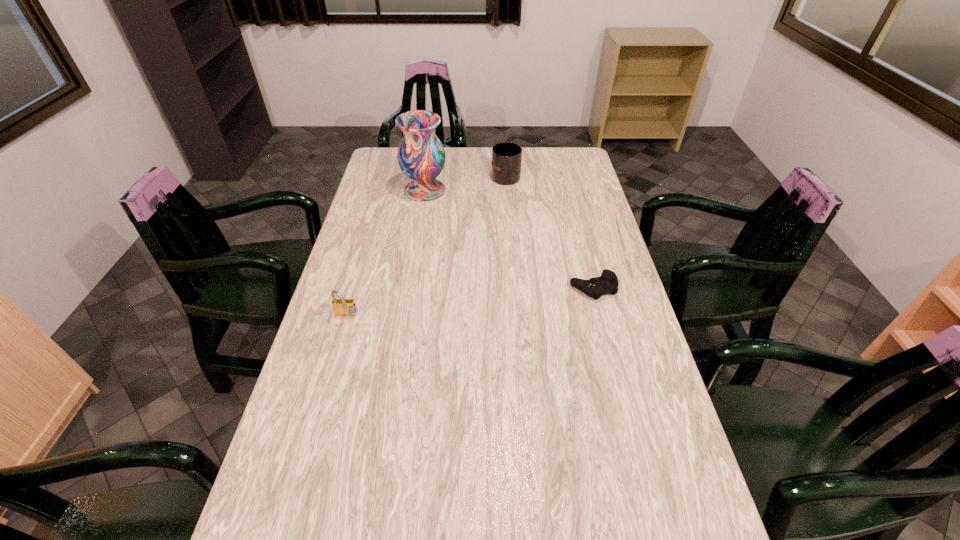
The width and height of the screenshot is (960, 540). What are the coordinates of `free location located with the handle on the side of the second object from right to left` in the screenshot? It's located at (504, 154).

What are the coordinates of `free spot located on the side with the combination dials of the nearest object` in the screenshot? It's located at (311, 438).

Where is `vacant space situated 0.270m on the back of the control`? The width and height of the screenshot is (960, 540). vacant space situated 0.270m on the back of the control is located at coordinates (x=576, y=221).

Find the location of a particular element. Image resolution: width=960 pixels, height=540 pixels. object situated at the far edge is located at coordinates (506, 161).

Where is `vase present at the left edge`? The width and height of the screenshot is (960, 540). vase present at the left edge is located at coordinates (421, 156).

Identify the location of padlock located in the left edge section of the desktop. (343, 307).

Where is `object positioned at the right edge`? This screenshot has height=540, width=960. object positioned at the right edge is located at coordinates (607, 283).

What are the coordinates of `vacant space at the left edge` in the screenshot? It's located at (408, 184).

Find the location of `vacant space at the right edge of the desktop`. vacant space at the right edge of the desktop is located at coordinates [x=644, y=517].

Where is `vacant space in between the leftmost object and the rightmost object`? vacant space in between the leftmost object and the rightmost object is located at coordinates (469, 302).